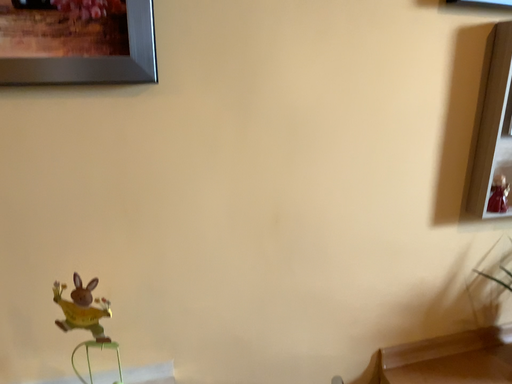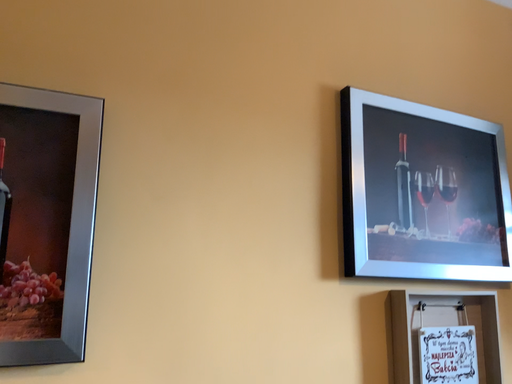
Question: Which way did the camera rotate in the video?

Choices:
 (A) rotated right
 (B) rotated left

Answer: (A)